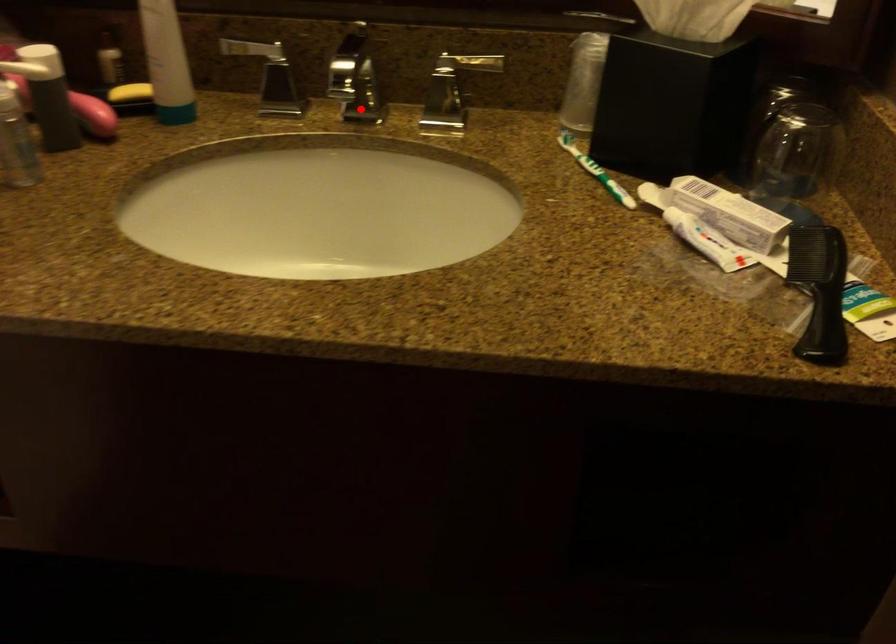
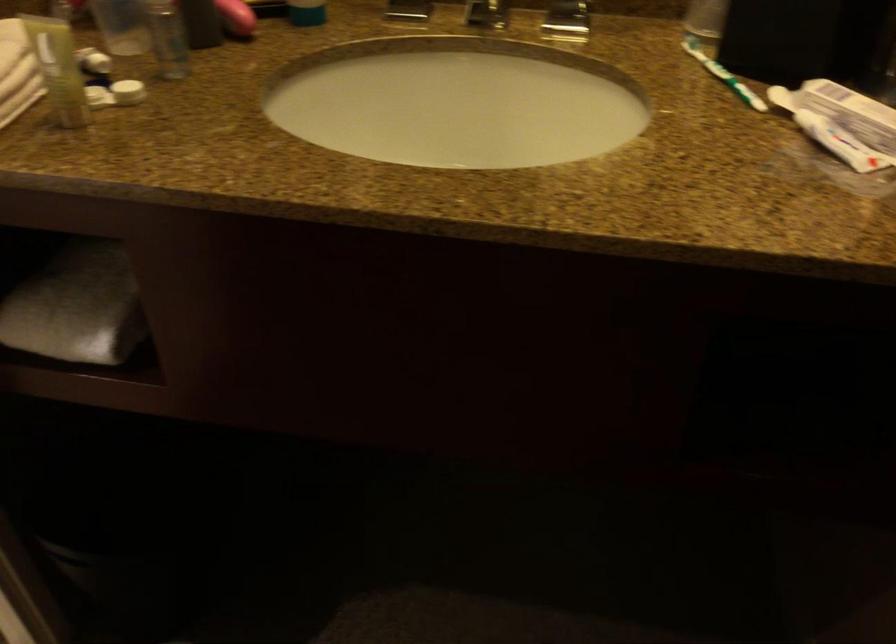
The point at the highlighted location is marked in the first image. Where is the corresponding point in the second image?

(486, 15)